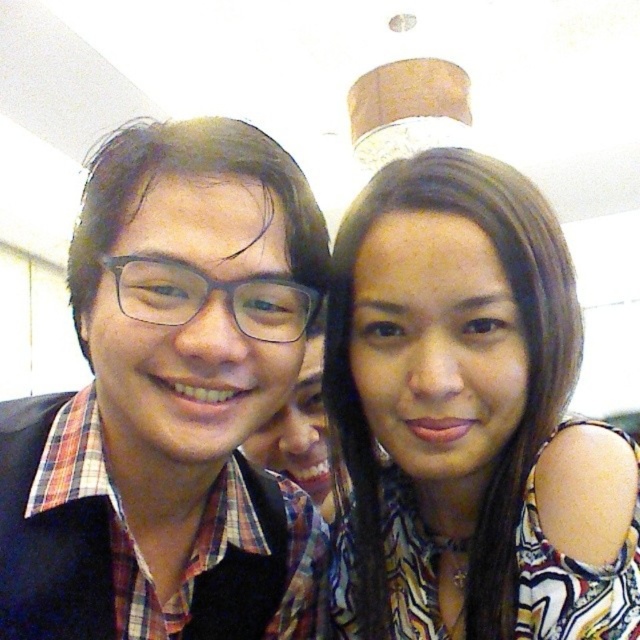
Which is more to the right, plaid fabric shirt at left or multicolored printed blouse at center?

Positioned to the right is multicolored printed blouse at center.

Which is in front, point (131, 445) or point (472, 397)?

Point (472, 397)

Locate an element on the screen. The image size is (640, 640). plaid fabric shirt at left is located at coordinates (170, 403).